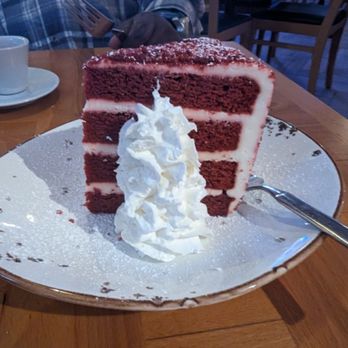
Find the location of a particular element. fork is located at coordinates (315, 216), (95, 25).